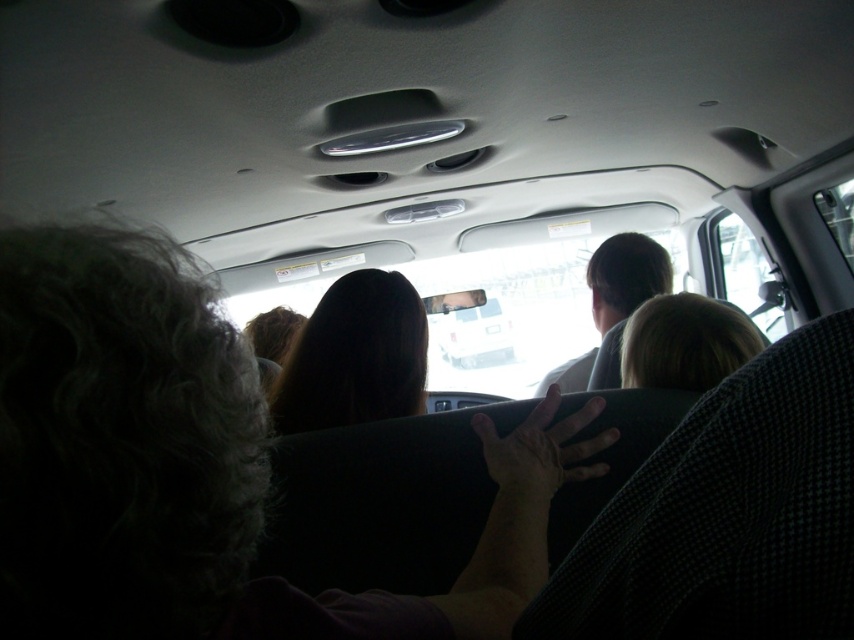
Can you confirm if dark brown hair at center is wider than blonde hair at center?

Incorrect, dark brown hair at center's width does not surpass blonde hair at center's.

Identify the location of dark brown hair at center. (355, 356).

What do you see at coordinates (355, 356) in the screenshot?
I see `dark brown hair at center` at bounding box center [355, 356].

What are the coordinates of `dark brown hair at center` in the screenshot? It's located at pos(355,356).

Locate an element on the screen. This screenshot has width=854, height=640. blonde hair at center is located at coordinates (685, 342).

Is point (665, 300) more distant than point (440, 340)?

No, it is not.

You are a GUI agent. You are given a task and a screenshot of the screen. Output one action in this format:
    pyautogui.click(x=<x>, y=<y>)
    Task: Click on the blonde hair at center
    Image resolution: width=854 pixels, height=640 pixels.
    Given the screenshot: What is the action you would take?
    pyautogui.click(x=685, y=342)

Looking at this image, between dark brown hair at center and white glossy car at center, which one is positioned lower?

white glossy car at center

Between point (317, 419) and point (466, 333), which one is positioned behind?

Positioned behind is point (466, 333).

Which is in front, point (402, 387) or point (478, 310)?

Point (402, 387) is more forward.

Find the location of a particular element. dark brown hair at center is located at coordinates (355, 356).